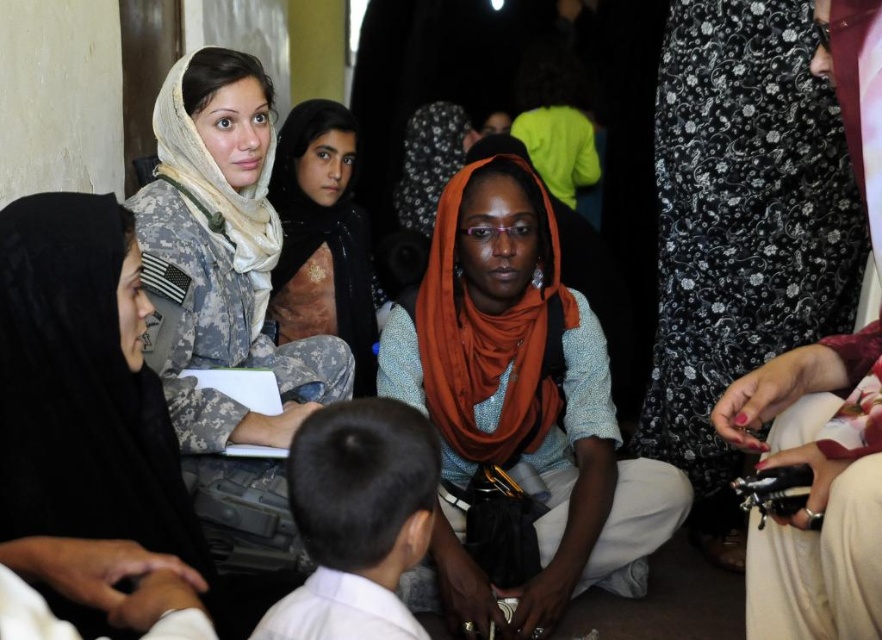
Which of these two, black matte uniform at left or black hair at center, stands taller?

black matte uniform at left is taller.

Which is more to the right, black matte uniform at left or black hair at center?

black hair at center is more to the right.

Where is `black matte uniform at left`? The image size is (882, 640). black matte uniform at left is located at coordinates (80, 388).

Where is `black matte uniform at left`? The height and width of the screenshot is (640, 882). black matte uniform at left is located at coordinates (80, 388).

Does orange fabric scarf at center appear on the right side of camouflage fabric uniform at upper left?

Correct, you'll find orange fabric scarf at center to the right of camouflage fabric uniform at upper left.

Based on the photo, does orange fabric scarf at center appear on the left side of camouflage fabric uniform at upper left?

In fact, orange fabric scarf at center is to the right of camouflage fabric uniform at upper left.

The height and width of the screenshot is (640, 882). Describe the element at coordinates (520, 404) in the screenshot. I see `orange fabric scarf at center` at that location.

Locate an element on the screen. orange fabric scarf at center is located at coordinates (520, 404).

Is camouflage fabric uniform at upper left smaller than matte khaki uniform at center?

Yes, camouflage fabric uniform at upper left is smaller than matte khaki uniform at center.

Does camouflage fabric uniform at upper left have a lesser width compared to matte khaki uniform at center?

No, camouflage fabric uniform at upper left is not thinner than matte khaki uniform at center.

This screenshot has height=640, width=882. What are the coordinates of `camouflage fabric uniform at upper left` in the screenshot? It's located at (221, 257).

Find the location of `camouflage fabric uniform at upper left`. camouflage fabric uniform at upper left is located at coordinates (221, 257).